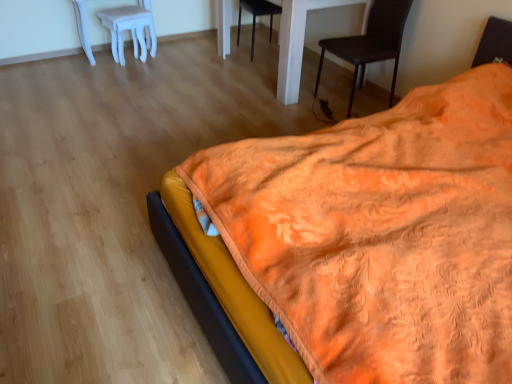
Locate an element on the screen. Image resolution: width=512 pixels, height=384 pixels. free location to the left of black leather chair at upper right, which appears as the second chair when viewed from the left is located at coordinates (297, 113).